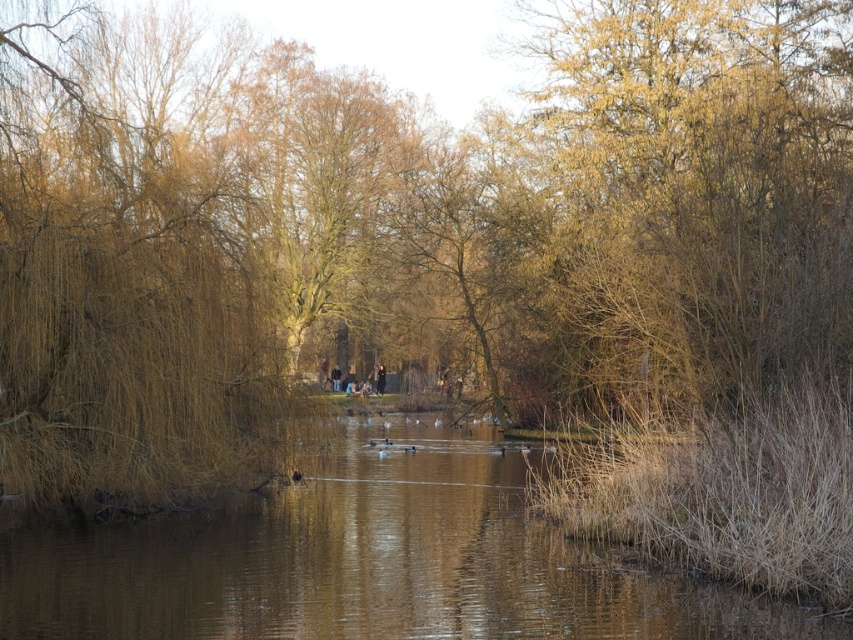
Question: Does brown grassy willow at left appear under brown grassy lake at center?

Choices:
 (A) yes
 (B) no

Answer: (B)

Question: In this image, where is brown grassy willow at left located relative to brown grassy lake at center?

Choices:
 (A) above
 (B) below

Answer: (A)

Question: Which point is closer to the camera?

Choices:
 (A) (234, 138)
 (B) (222, 608)

Answer: (B)

Question: Is brown grassy willow at left bigger than brown grassy lake at center?

Choices:
 (A) yes
 (B) no

Answer: (A)